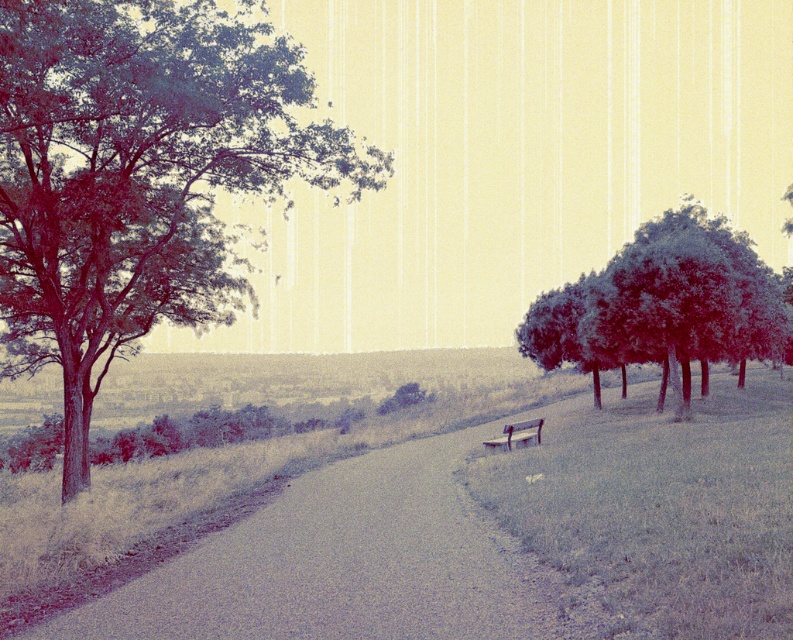
You are a painter setting up your easel to capture the scene. You have the smooth green trees at right and the wooden park bench at center in your view. Which object should you focus on first if you want to paint the taller one?

The smooth green trees at right are taller than the wooden park bench at center, so you should focus on the smooth green trees at right first.

You are standing at the starting point of the pathway and see two points marked on the ground ahead of you. The first point is at coordinates point (x=221, y=96) and the second is at point (x=634, y=266). Which of these points is closer to you as you walk along the path?

Point (x=221, y=96) is in front of point (x=634, y=266), so the first point is closer to you as you walk along the path.

You are standing at the origin point in this outdoor scene. Where is the smooth asphalt road at center located in terms of coordinates?

The smooth asphalt road at center is located at coordinates point (343, 563).